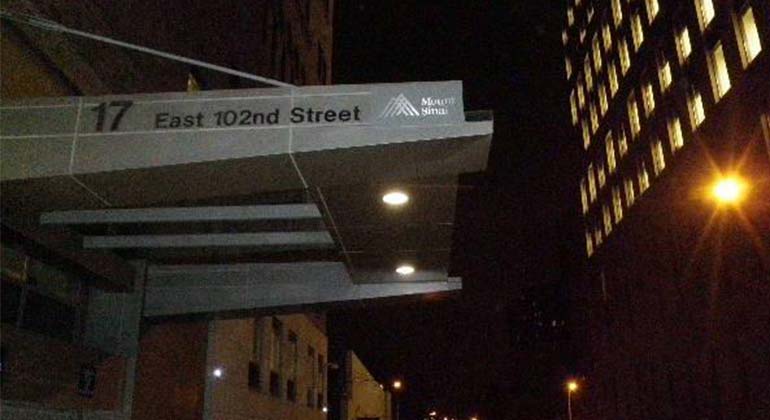
At what (x,y) coordinates should I click in order to perform the action: click on lights. Please return your answer as a coordinate pair (x, y). This screenshot has width=770, height=420. Looking at the image, I should click on (393, 204), (406, 274), (221, 373), (325, 408), (393, 383), (574, 386).